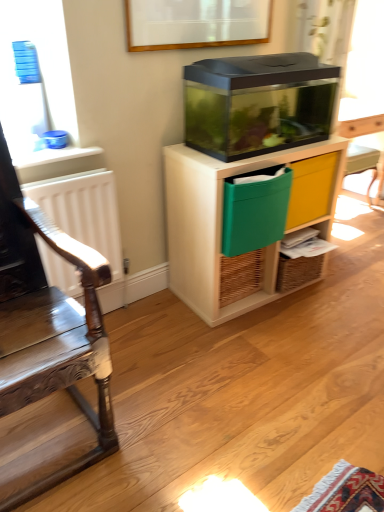
Where is `vacant area that lies in front of white matte radiator at left`? The image size is (384, 512). vacant area that lies in front of white matte radiator at left is located at coordinates (120, 356).